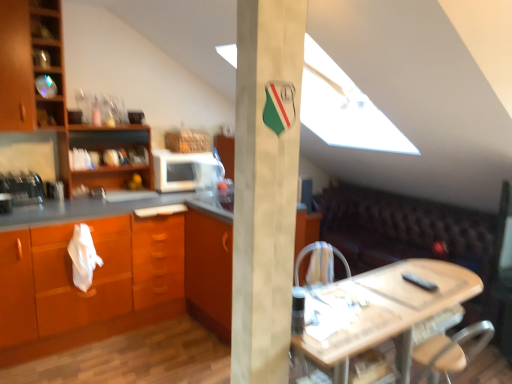
Find the location of `matte wood countertop at left`. matte wood countertop at left is located at coordinates (135, 287).

The height and width of the screenshot is (384, 512). What do you see at coordinates (182, 171) in the screenshot?
I see `white matte microwave at center, the 2th appliance positioned from the front` at bounding box center [182, 171].

This screenshot has height=384, width=512. I want to click on metallic silver toaster at left, which is the 2th appliance in back-to-front order, so click(22, 187).

Describe the element at coordinates (102, 154) in the screenshot. This screenshot has width=512, height=384. I see `wooden shelves at left` at that location.

At what (x,y) coordinates should I click in order to perform the action: click on matte wood countertop at left. Please return your answer as a coordinate pair (x, y). The image size is (512, 384). Looking at the image, I should click on (135, 287).

You are a GUI agent. You are given a task and a screenshot of the screen. Output one action in this format:
    pyautogui.click(x=<x>, y=<y>)
    Task: Click on the countertop lying below the white matte microwave at center, which is counted as the first appliance, starting from the right (from the image's perspective)
    This screenshot has height=384, width=512.
    Given the screenshot: What is the action you would take?
    pyautogui.click(x=135, y=287)

Is white matte microwave at center, which is counted as the first appliance, starting from the right, closer to the viewer compared to matte wood countertop at left?

That is False.

From the image's perspective, is white matte microwave at center, the second appliance from the left, above or below matte wood countertop at left?

white matte microwave at center, the second appliance from the left, is above matte wood countertop at left.

Considering the sizes of white matte microwave at center, the 2th appliance positioned from the front, and matte wood countertop at left in the image, is white matte microwave at center, the 2th appliance positioned from the front, taller or shorter than matte wood countertop at left?

Considering their sizes, white matte microwave at center, the 2th appliance positioned from the front, has less height than matte wood countertop at left.

This screenshot has width=512, height=384. What are the coordinates of `table in front of the wooden cabinet at left, which appears as the second cabinetry when ordered from the bottom` in the screenshot? It's located at (387, 312).

Measure the distance between wooden table at center and wooden cabinet at left, arranged as the first cabinetry when viewed from the left.

wooden table at center is 7.46 feet away from wooden cabinet at left, arranged as the first cabinetry when viewed from the left.

From a real-world perspective, is wooden table at center beneath wooden cabinet at left, which appears as the second cabinetry when ordered from the bottom?

Yes, from a real-world perspective, wooden table at center is below wooden cabinet at left, which appears as the second cabinetry when ordered from the bottom.

Is wooden table at center in front of wooden cabinet at left, arranged as the first cabinetry when viewed from the left?

Yes, the depth of wooden table at center is less than that of wooden cabinet at left, arranged as the first cabinetry when viewed from the left.

Considering the sizes of objects matte wood countertop at left and white matte pillar at center in the image provided, who is shorter, matte wood countertop at left or white matte pillar at center?

Standing shorter between the two is matte wood countertop at left.

Consider the image. How different are the orientations of matte wood countertop at left and white matte pillar at center in degrees?

3.5 degrees.

From the image's perspective, is matte wood countertop at left over white matte pillar at center?

No, from the image's perspective, matte wood countertop at left is not above white matte pillar at center.

Is matte wood countertop at left with white matte pillar at center?

No, matte wood countertop at left is not in contact with white matte pillar at center.

Is brown leather couch at lower right facing away from wooden cabinet at left, which appears as the second cabinetry when ordered from the bottom?

brown leather couch at lower right is not turned away from wooden cabinet at left, which appears as the second cabinetry when ordered from the bottom.

In the image, is brown leather couch at lower right on the left side or the right side of wooden cabinet at left, arranged as the first cabinetry when viewed from the left?

Based on their positions, brown leather couch at lower right is located to the right of wooden cabinet at left, arranged as the first cabinetry when viewed from the left.

Is the surface of brown leather couch at lower right in direct contact with wooden cabinet at left, which appears as the second cabinetry when ordered from the bottom?

brown leather couch at lower right is not next to wooden cabinet at left, which appears as the second cabinetry when ordered from the bottom, and they're not touching.

In terms of size, does brown leather couch at lower right appear bigger or smaller than metallic silver toaster at left, which is the first appliance from left to right?

Considering their sizes, brown leather couch at lower right takes up more space than metallic silver toaster at left, which is the first appliance from left to right.

Is brown leather couch at lower right positioned far away from metallic silver toaster at left, the 2th appliance from the right?

Yes, brown leather couch at lower right is far from metallic silver toaster at left, the 2th appliance from the right.

Based on their positions, is brown leather couch at lower right located to the left or right of metallic silver toaster at left, arranged as the 1th appliance when viewed from the front?

Clearly, brown leather couch at lower right is on the right of metallic silver toaster at left, arranged as the 1th appliance when viewed from the front, in the image.

From the picture: How many degrees apart are the facing directions of brown leather couch at lower right and metallic silver toaster at left, the 2th appliance from the right?

The facing directions of brown leather couch at lower right and metallic silver toaster at left, the 2th appliance from the right, are 89.4 degrees apart.

Is white matte pillar at center far away from metallic silver toaster at left, arranged as the 1th appliance when viewed from the front?

That's right, there is a large distance between white matte pillar at center and metallic silver toaster at left, arranged as the 1th appliance when viewed from the front.

Is white matte pillar at center positioned with its back to metallic silver toaster at left, which is the first appliance from left to right?

No, white matte pillar at center is not facing away from metallic silver toaster at left, which is the first appliance from left to right.

Considering the positions of objects white matte pillar at center and metallic silver toaster at left, which is the first appliance from left to right, in the image provided, who is in front, white matte pillar at center or metallic silver toaster at left, which is the first appliance from left to right,?

white matte pillar at center.

Can you tell me how much white matte pillar at center and metallic silver toaster at left, which is the first appliance from left to right, differ in facing direction?

3.5 degrees separate the facing orientations of white matte pillar at center and metallic silver toaster at left, which is the first appliance from left to right.

How many degrees apart are the facing directions of wooden table at center and white matte pillar at center?

wooden table at center and white matte pillar at center are facing 3.43 degrees away from each other.

Would you consider wooden table at center to be distant from white matte pillar at center?

That's not correct — wooden table at center is a little close to white matte pillar at center.

Is wooden table at center completely or partially outside of white matte pillar at center?

Yes.

Considering the relative sizes of wooden table at center and white matte pillar at center in the image provided, is wooden table at center thinner than white matte pillar at center?

Incorrect, the width of wooden table at center is not less than that of white matte pillar at center.

Where is `countertop on the left of the white matte microwave at center, which is counted as the first appliance, starting from the right`? The image size is (512, 384). countertop on the left of the white matte microwave at center, which is counted as the first appliance, starting from the right is located at coordinates (135, 287).

Identify the location of table that is in front of the wooden cabinet at left, the 2th cabinetry positioned from the right. The image size is (512, 384). (387, 312).

Looking at the image, which one is located closer to metallic silver toaster at left, the 2th appliance from the right, orange wood cabinet at left, the first cabinetry ordered from the bottom, or wooden table at center?

orange wood cabinet at left, the first cabinetry ordered from the bottom, is closer to metallic silver toaster at left, the 2th appliance from the right.

Looking at the image, which one is located closer to white matte microwave at center, the second appliance from the left, matte wood countertop at left or metallic silver toaster at left, arranged as the 1th appliance when viewed from the front?

The object closer to white matte microwave at center, the second appliance from the left, is matte wood countertop at left.

Looking at the image, which one is located further to brown leather couch at lower right, wooden cabinet at left, which appears as the second cabinetry when ordered from the bottom, or wooden shelves at left?

wooden cabinet at left, which appears as the second cabinetry when ordered from the bottom.

Based on their spatial positions, is wooden table at center or brown leather couch at lower right closer to wooden cabinet at left, the 2th cabinetry positioned from the right?

Based on the image, wooden table at center appears to be nearer to wooden cabinet at left, the 2th cabinetry positioned from the right.

Which object lies nearer to the anchor point white matte pillar at center, wooden table at center or metallic silver toaster at left, the 2th appliance from the right?

wooden table at center is positioned closer to the anchor white matte pillar at center.

Considering their positions, is wooden cabinet at left, which appears as the second cabinetry when ordered from the bottom, positioned further to brown leather couch at lower right than white matte pillar at center?

wooden cabinet at left, which appears as the second cabinetry when ordered from the bottom, lies further to brown leather couch at lower right than the other object.

Consider the image. Looking at the image, which one is located further to brown leather couch at lower right, wooden cabinet at left, the 2th cabinetry positioned from the right, or white matte microwave at center, the second appliance from the left?

Based on the image, wooden cabinet at left, the 2th cabinetry positioned from the right, appears to be further to brown leather couch at lower right.

When comparing their distances from white fabric armchair at center, does orange wood cabinet at left, which is the 1th cabinetry from right to left, or wooden shelves at left seem further?

Among the two, wooden shelves at left is located further to white fabric armchair at center.

The image size is (512, 384). I want to click on pillar between matte wood countertop at left and wooden table at center in the horizontal direction, so click(x=264, y=190).

Locate an element on the screen. This screenshot has width=512, height=384. table between wooden shelves at left and brown leather couch at lower right is located at coordinates (387, 312).

The height and width of the screenshot is (384, 512). In order to click on shelf situated between metallic silver toaster at left, the 2th appliance from the right, and brown leather couch at lower right from left to right in this screenshot , I will do `click(102, 154)`.

Locate an element on the screen. The image size is (512, 384). cabinetry between white matte microwave at center, the second appliance from the left, and brown leather couch at lower right is located at coordinates (209, 266).